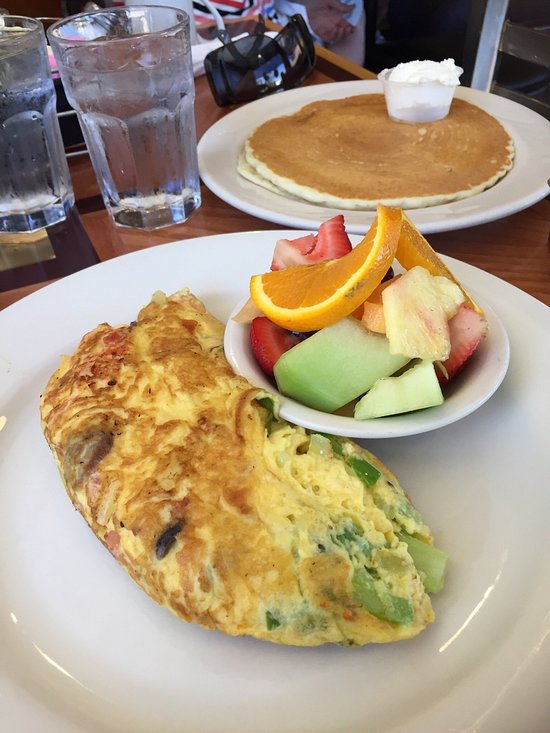
Identify the location of large white plate. This screenshot has height=733, width=550. (415, 671).